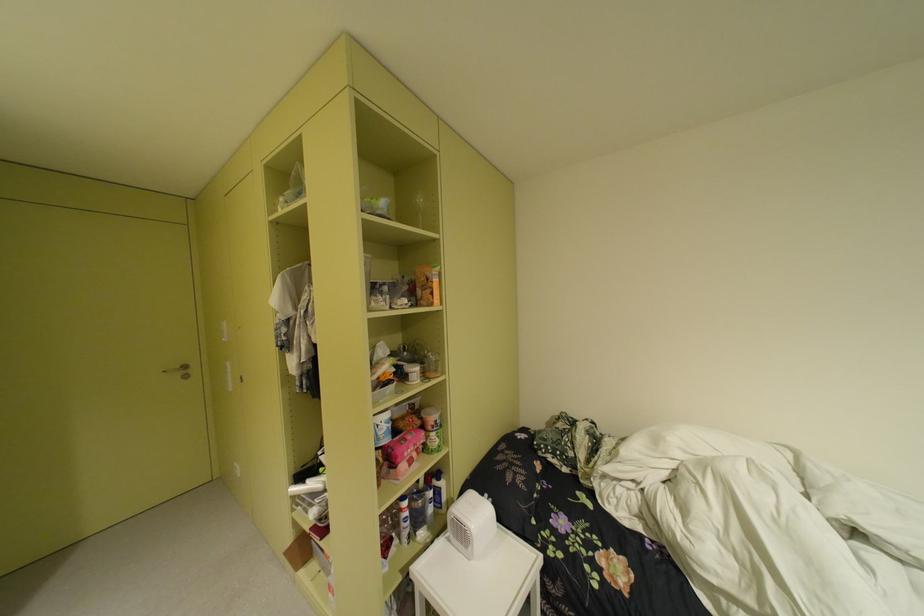
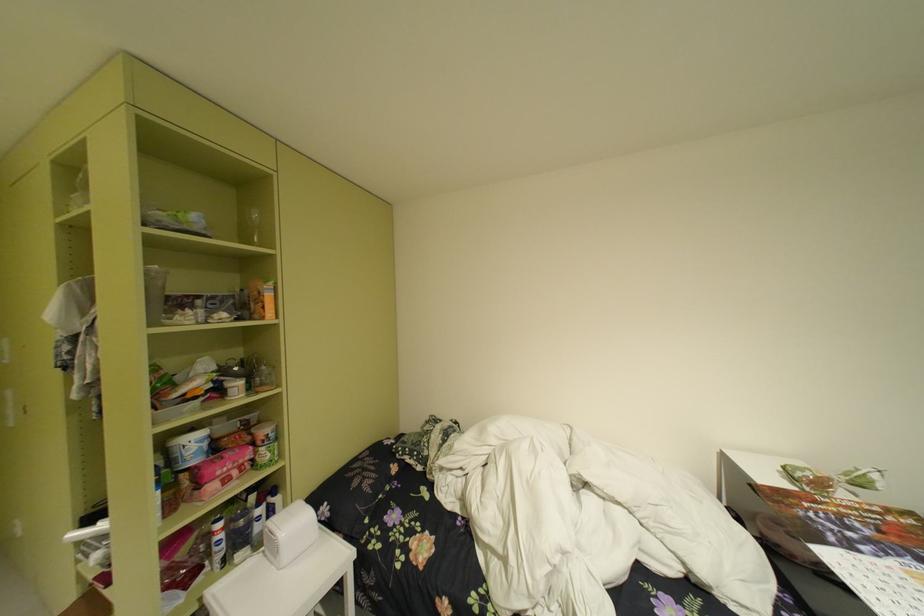
In the second image, find the point that corresponds to the point at 419,507 in the first image.

(235, 528)